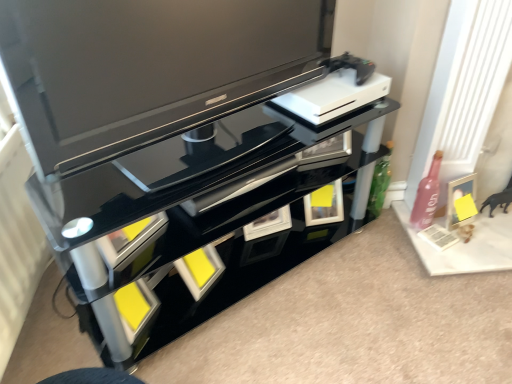
Question: Considering the relative positions of matte silver picture frame at right and pink glass bottle at right in the image provided, is matte silver picture frame at right in front of pink glass bottle at right?

Choices:
 (A) no
 (B) yes

Answer: (A)

Question: From a real-world perspective, is matte silver picture frame at right on top of pink glass bottle at right?

Choices:
 (A) yes
 (B) no

Answer: (B)

Question: Is matte silver picture frame at right bigger than pink glass bottle at right?

Choices:
 (A) no
 (B) yes

Answer: (A)

Question: Considering the relative sizes of matte silver picture frame at right and pink glass bottle at right in the image provided, is matte silver picture frame at right wider than pink glass bottle at right?

Choices:
 (A) yes
 (B) no

Answer: (B)

Question: Is matte silver picture frame at right completely or partially outside of pink glass bottle at right?

Choices:
 (A) no
 (B) yes

Answer: (B)

Question: Considering the positions of point (18, 61) and point (454, 208), is point (18, 61) closer or farther from the camera than point (454, 208)?

Choices:
 (A) farther
 (B) closer

Answer: (B)

Question: Is matte black tv at upper center spatially inside matte silver picture frame at right, or outside of it?

Choices:
 (A) outside
 (B) inside

Answer: (A)

Question: Considering the positions of matte black tv at upper center and matte silver picture frame at right in the image, is matte black tv at upper center bigger or smaller than matte silver picture frame at right?

Choices:
 (A) big
 (B) small

Answer: (A)

Question: From a real-world perspective, relative to matte silver picture frame at right, is matte black tv at upper center vertically above or below?

Choices:
 (A) above
 (B) below

Answer: (A)

Question: Is matte silver picture frame at right wider or thinner than pink glass bottle at right?

Choices:
 (A) wide
 (B) thin

Answer: (B)

Question: Based on their sizes in the image, would you say matte silver picture frame at right is bigger or smaller than pink glass bottle at right?

Choices:
 (A) small
 (B) big

Answer: (A)

Question: From a real-world perspective, is matte silver picture frame at right positioned above or below pink glass bottle at right?

Choices:
 (A) below
 (B) above

Answer: (A)

Question: Relative to pink glass bottle at right, is matte silver picture frame at right in front or behind?

Choices:
 (A) behind
 (B) front

Answer: (A)

Question: In the image, is pink glass bottle at right positioned in front of or behind matte black tv at upper center?

Choices:
 (A) front
 (B) behind

Answer: (B)

Question: Is point [437, 168] positioned closer to the camera than point [274, 39]?

Choices:
 (A) farther
 (B) closer

Answer: (A)